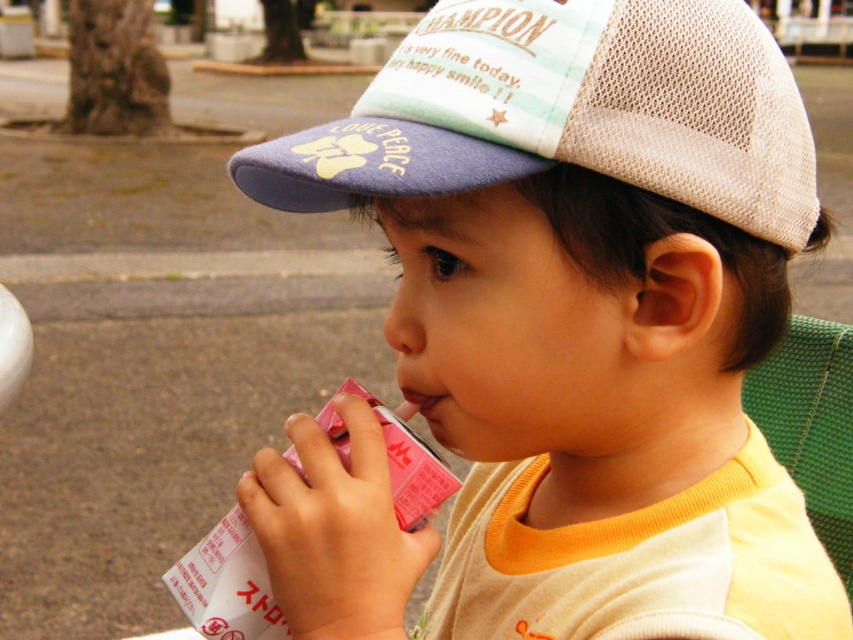
Question: Is matte plastic cup at center further to camera compared to pastel striped mesh cap at upper center?

Choices:
 (A) yes
 (B) no

Answer: (B)

Question: Which object appears closest to the camera in this image?

Choices:
 (A) pastel striped mesh cap at upper center
 (B) matte plastic cup at center

Answer: (B)

Question: Which point is closer to the camera?

Choices:
 (A) (491, 58)
 (B) (535, 44)

Answer: (B)

Question: Is matte plastic cup at center closer to the viewer compared to pastel striped mesh cap at upper center?

Choices:
 (A) yes
 (B) no

Answer: (A)

Question: Does matte plastic cup at center come in front of pastel striped mesh cap at upper center?

Choices:
 (A) no
 (B) yes

Answer: (B)